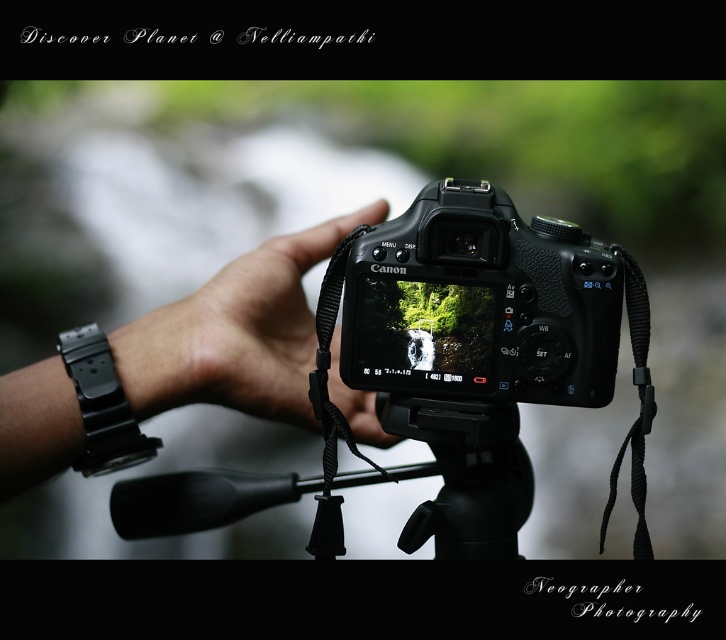
Between black plastic camera at center and black rubber tripod at center, which one has more height?

Standing taller between the two is black plastic camera at center.

Does black plastic camera at center appear under black rubber tripod at center?

Actually, black plastic camera at center is above black rubber tripod at center.

Which is in front, point (542, 340) or point (513, 522)?

Point (542, 340) is in front.

Find the location of a particular element. This screenshot has width=726, height=640. black plastic camera at center is located at coordinates coord(481,304).

Which is behind, point (248, 374) or point (515, 422)?

Point (248, 374)

Which is in front, point (269, 253) or point (436, 424)?

Positioned in front is point (436, 424).

At what (x,y) coordinates should I click in order to perform the action: click on black matte hand at center. Please return your answer as a coordinate pair (x, y). This screenshot has width=726, height=640. Looking at the image, I should click on (236, 333).

Between black plastic camera at center and black matte hand at center, which one is positioned higher?

black plastic camera at center

Is black plastic camera at center below black matte hand at center?

Incorrect, black plastic camera at center is not positioned below black matte hand at center.

From the picture: Measure the distance between black plastic camera at center and camera.

The distance of black plastic camera at center from camera is 25.07 inches.

Find the location of a particular element. black plastic camera at center is located at coordinates (481, 304).